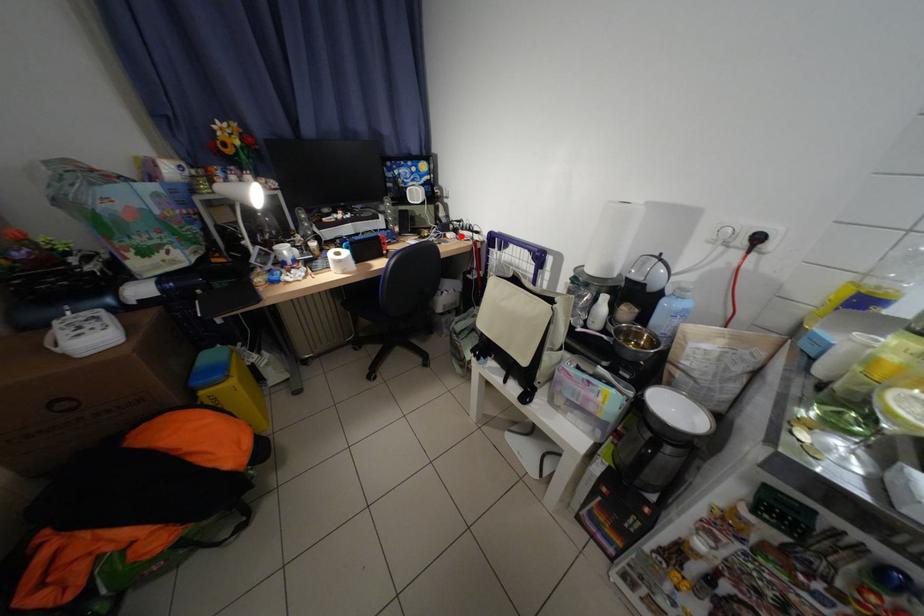
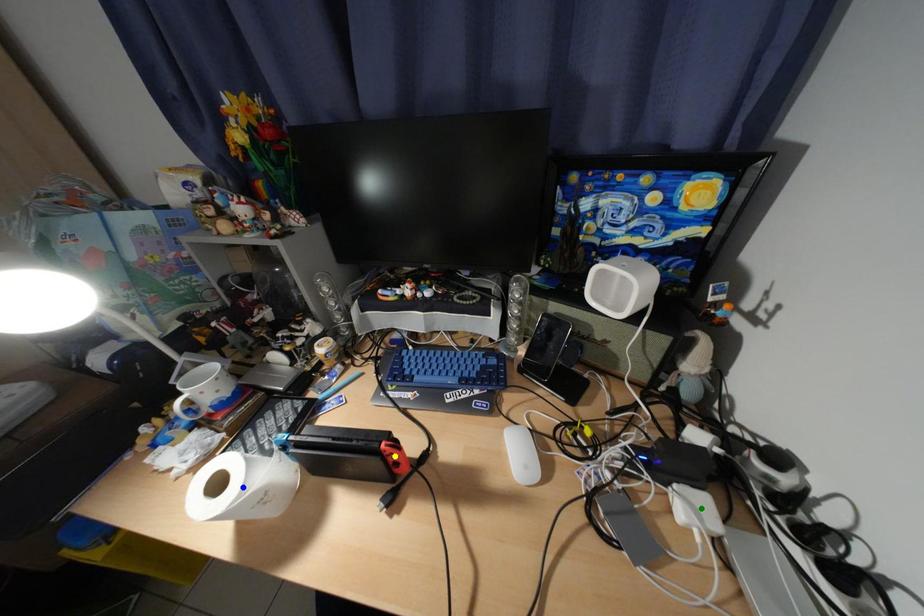
Question: I am providing you with two images of the same scene from different viewpoints. A red point is marked on the first image. You are given multiple points on the second image. Which spot in image 2 lines up with the point in image 1?

Choices:
 (A) green point
 (B) blue point
 (C) yellow point

Answer: (A)